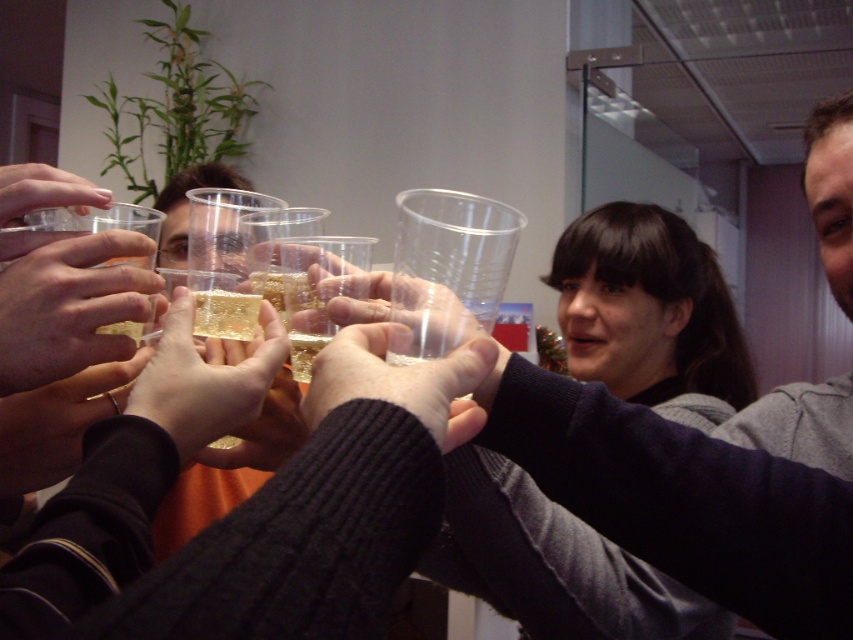
Is point (51, 328) farther from camera compared to point (79, 374)?

No, (51, 328) is in front of (79, 374).

Who is higher up, matte gold ring at center or black matte hand at lower left?

matte gold ring at center is above.

The width and height of the screenshot is (853, 640). What do you see at coordinates (68, 307) in the screenshot? I see `matte gold ring at center` at bounding box center [68, 307].

This screenshot has height=640, width=853. I want to click on matte gold ring at center, so click(x=68, y=307).

Does black matte hand at lower left have a larger size compared to transparent plastic cup at upper left?

Actually, black matte hand at lower left might be smaller than transparent plastic cup at upper left.

Between point (41, 452) and point (22, 182), which one is positioned in front?

Point (22, 182) is in front.

Which is behind, point (61, 408) or point (68, 196)?

The point (61, 408) is more distant.

Identify the location of black matte hand at lower left. (57, 422).

Does point (372, 337) come in front of point (202, 323)?

Yes, point (372, 337) is in front of point (202, 323).

Between point (454, 426) and point (218, 317), which one is positioned in front?

Point (454, 426) is in front.

The height and width of the screenshot is (640, 853). Describe the element at coordinates (401, 381) in the screenshot. I see `transparent plastic cup at center` at that location.

Identify the location of transparent plastic cup at center. Image resolution: width=853 pixels, height=640 pixels. (401, 381).